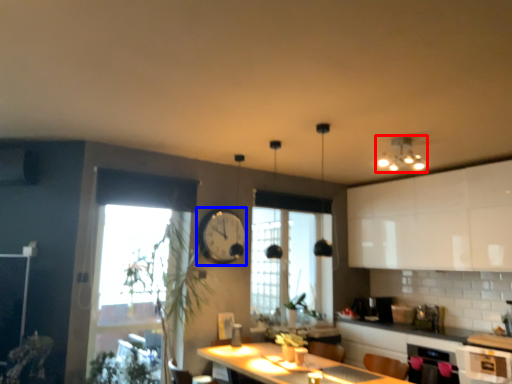
Question: Which of the following is the farthest to the observer, light fixture (highlighted by a red box) or clock (highlighted by a blue box)?

Choices:
 (A) light fixture
 (B) clock

Answer: (B)